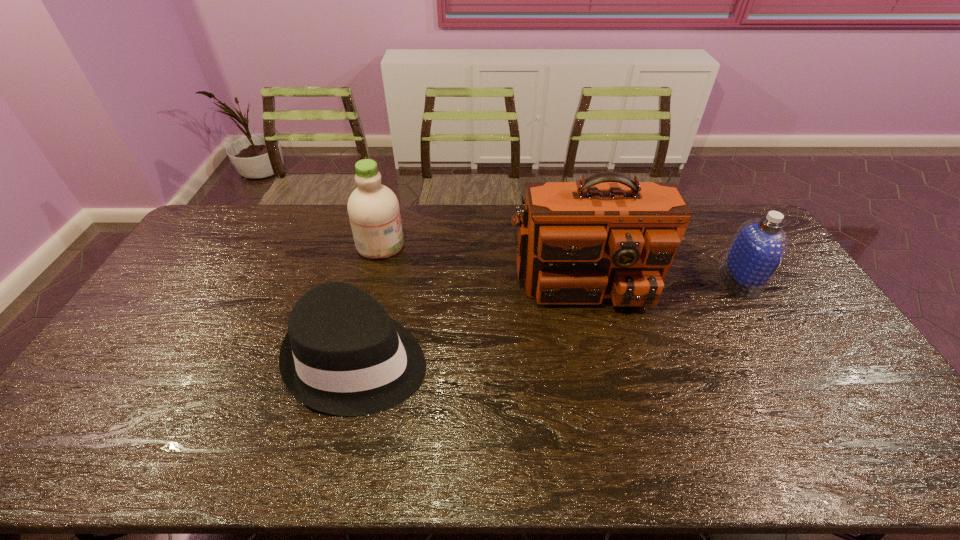
At what (x,y) coordinates should I click in order to perform the action: click on vacant space that's between the shortest object and the right cleansing agent. Please return your answer as a coordinate pair (x, y). Looking at the image, I should click on (549, 320).

Identify the location of unoccupied area between the shortest object and the third tallest object. The width and height of the screenshot is (960, 540). (549, 320).

Image resolution: width=960 pixels, height=540 pixels. I want to click on free space between the second object from right to left and the taller cleansing agent, so click(x=481, y=253).

Where is `free spot between the taller cleansing agent and the third object from left to right`? free spot between the taller cleansing agent and the third object from left to right is located at coordinates (481, 253).

At what (x,y) coordinates should I click in order to perform the action: click on free spot between the left cleansing agent and the satchel. Please return your answer as a coordinate pair (x, y). This screenshot has width=960, height=540. Looking at the image, I should click on (481, 253).

Locate which object ranks second in proximity to the tallest object. Please provide its 2D coordinates. Your answer should be formatted as a tuple, i.e. [(x, y)], where the tuple contains the x and y coordinates of a point satisfying the conditions above.

[(343, 355)]

Locate an element on the screen. The height and width of the screenshot is (540, 960). the closest object relative to the taller cleansing agent is located at coordinates (343, 355).

Where is `blank area in the image that satisfies the following two spatial constraints: 1. on the back side of the fedora; 2. on the left side of the rightmost object`? Image resolution: width=960 pixels, height=540 pixels. blank area in the image that satisfies the following two spatial constraints: 1. on the back side of the fedora; 2. on the left side of the rightmost object is located at coordinates pyautogui.click(x=377, y=280).

In order to click on blank space that satisfies the following two spatial constraints: 1. on the face side of the shorter cleansing agent; 2. on the left side of the second object from right to left in this screenshot , I will do (x=587, y=280).

Where is `vacant point that satisfies the following two spatial constraints: 1. on the front label of the farther cleansing agent; 2. on the back side of the fedora`? The image size is (960, 540). vacant point that satisfies the following two spatial constraints: 1. on the front label of the farther cleansing agent; 2. on the back side of the fedora is located at coordinates (351, 359).